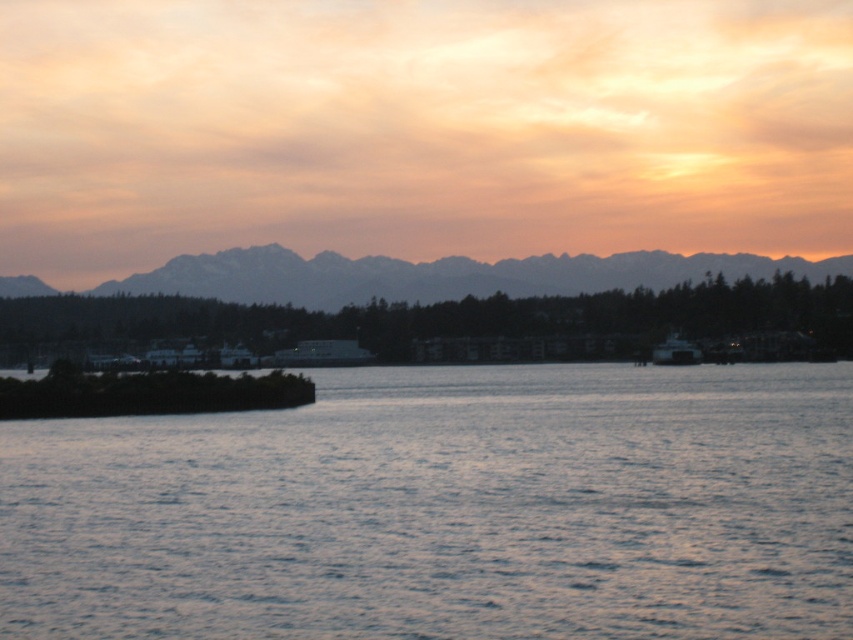
You are an artist planning to paint the sunset scene. You want to ensure that the blue water at center and the distant gray mountains at upper center are proportionally accurate. Based on the scene, which object should you paint to be larger in your artwork?

The distant gray mountains at upper center should be painted larger than the blue water at center because the blue water at center is smaller than the distant gray mountains at upper center according to the description.

You are an observer standing on the shore looking at the distant gray mountains at upper center and the metallic gray boat at right. Which object appears closer to you?

The metallic gray boat at right appears closer to you because the distant gray mountains at upper center are further away.

You are standing on the shore looking at the sunset. You see the blue water at center and the metallic gray boat at right. Which object is closer to the horizon?

The metallic gray boat at right is closer to the horizon because the blue water at center is below it, meaning the boat is positioned higher relative to the water and thus farther away from the observer, aligning it more with the horizon line.